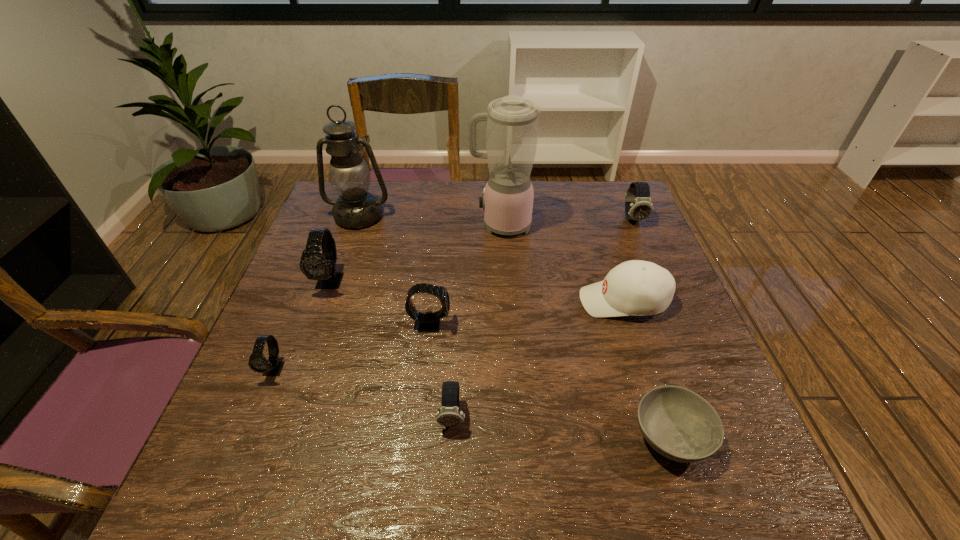
Image resolution: width=960 pixels, height=540 pixels. In order to click on food processor in this screenshot , I will do `click(512, 121)`.

You are a GUI agent. You are given a task and a screenshot of the screen. Output one action in this format:
    pyautogui.click(x=<x>, y=<y>)
    Task: Click on the oil lamp
    This screenshot has height=540, width=960.
    Given the screenshot: What is the action you would take?
    pyautogui.click(x=355, y=208)

Where is `the biggest gray watch`? The width and height of the screenshot is (960, 540). the biggest gray watch is located at coordinates (315, 264).

Image resolution: width=960 pixels, height=540 pixels. In order to click on the seventh shortest object in this screenshot , I will do `click(315, 264)`.

Locate an element on the screen. the second nearest gray watch is located at coordinates (429, 322).

The width and height of the screenshot is (960, 540). What are the coordinates of `the second biggest gray watch` in the screenshot? It's located at (429, 322).

What are the coordinates of `the farthest watch` in the screenshot? It's located at (638, 206).

This screenshot has width=960, height=540. In order to click on the rightmost watch in this screenshot , I will do `click(638, 206)`.

This screenshot has width=960, height=540. In order to click on baseball cap in this screenshot , I will do coord(636,287).

At what (x,y) coordinates should I click in order to perform the action: click on the seventh farthest object. Please return your answer as a coordinate pair (x, y). Image resolution: width=960 pixels, height=540 pixels. Looking at the image, I should click on (258, 363).